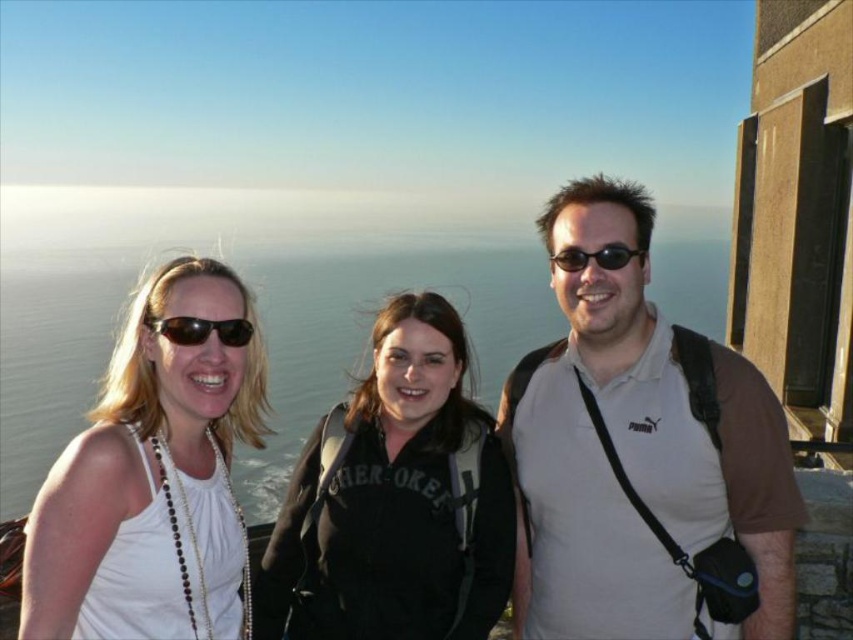
Question: Can you confirm if black matte jacket at center is positioned to the right of black plastic sunglasses at center?

Choices:
 (A) yes
 (B) no

Answer: (B)

Question: Does brown cotton polo shirt at center appear over matte black sunglasses at center?

Choices:
 (A) no
 (B) yes

Answer: (A)

Question: Which object appears farthest from the camera in this image?

Choices:
 (A) white matte tank top at left
 (B) black matte jacket at center
 (C) brown cotton polo shirt at center

Answer: (B)

Question: Which of the following is the closest to the observer?

Choices:
 (A) (624, 250)
 (B) (463, 506)
 (C) (602, 492)

Answer: (A)

Question: Which point is closer to the camera?

Choices:
 (A) (448, 518)
 (B) (604, 225)
 (C) (231, 525)
 (D) (585, 262)

Answer: (C)

Question: Does brown cotton polo shirt at center appear over black matte jacket at center?

Choices:
 (A) yes
 (B) no

Answer: (A)